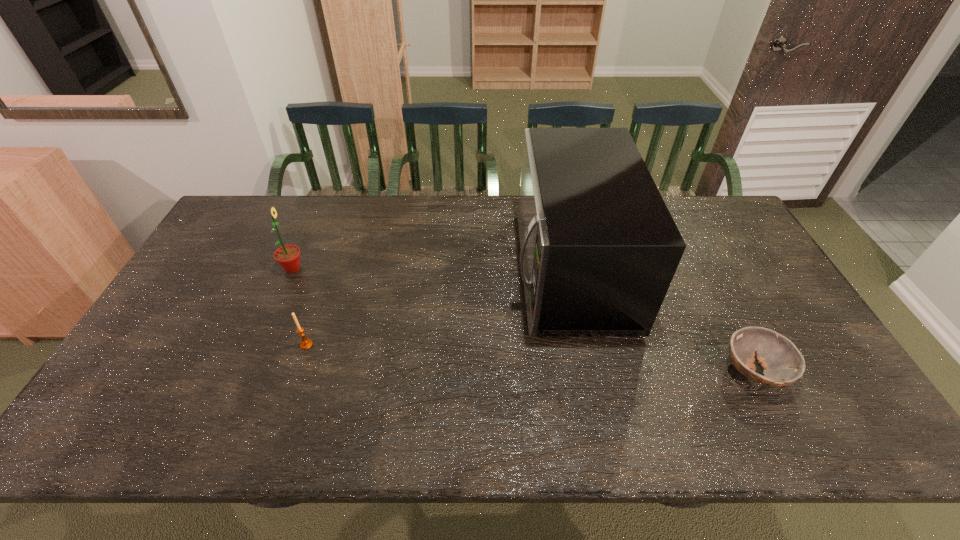
At what (x,y) coordinates should I click in order to perform the action: click on free space between the microwave oven and the bowl. Please return your answer as a coordinate pair (x, y). The image size is (960, 540). Looking at the image, I should click on (661, 320).

This screenshot has height=540, width=960. I want to click on vacant region between the second tallest object and the tallest object, so click(431, 269).

The height and width of the screenshot is (540, 960). I want to click on vacant area that lies between the shortest object and the second shortest object, so click(530, 358).

Identify the location of free point between the tallest object and the sunflower. [x=431, y=269].

Where is `vacant area that lies between the third tallest object and the sunflower`? This screenshot has width=960, height=540. vacant area that lies between the third tallest object and the sunflower is located at coordinates (300, 307).

The height and width of the screenshot is (540, 960). What are the coordinates of `vacant area between the sunflower and the second object from right to left` in the screenshot? It's located at (431, 269).

The image size is (960, 540). Find the location of `free space between the candle_holder and the shortest object`. free space between the candle_holder and the shortest object is located at coordinates (530, 358).

Locate an element on the screen. empty space that is in between the bowl and the tallest object is located at coordinates (661, 320).

In order to click on vacant space in between the third tallest object and the sunflower in this screenshot , I will do (x=300, y=307).

The height and width of the screenshot is (540, 960). I want to click on empty location between the rightmost object and the second tallest object, so tap(523, 320).